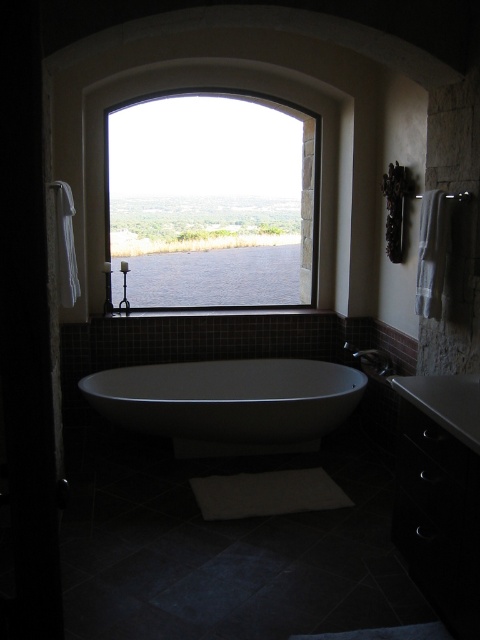
You are standing in the luxurious bathroom and want to take a bath. Where is the white glossy bathtub at center located in this room?

The white glossy bathtub at center is located at point (229, 403) in the room.

You are a guest in this bathroom and need to wash your hands. The white glossy bathtub at center is in your way. Can you move around it to reach the white glossy sink at lower right?

The white glossy bathtub at center is below the white glossy sink at lower right, so the sink is positioned higher up. Since the bathtub is below, you can move around it to reach the sink as they are at different vertical levels.